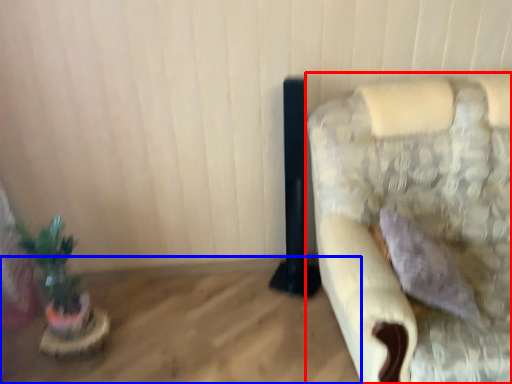
Question: Which of the following is the closest to the observer, furniture (highlighted by a red box) or table (highlighted by a blue box)?

Choices:
 (A) furniture
 (B) table

Answer: (A)